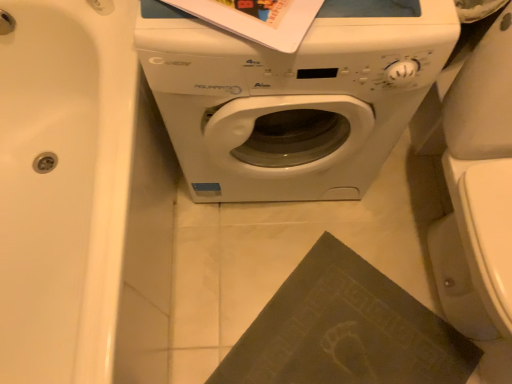
The image size is (512, 384). Describe the element at coordinates (293, 97) in the screenshot. I see `white glossy washing machine at center` at that location.

What do you see at coordinates (64, 187) in the screenshot? I see `white glossy bathtub at left` at bounding box center [64, 187].

You are a GUI agent. You are given a task and a screenshot of the screen. Output one action in this format:
    pyautogui.click(x=<x>, y=<y>)
    Task: Click on the dark matte book at lower right
    Image resolution: width=512 pixels, height=384 pixels.
    Given the screenshot: What is the action you would take?
    pyautogui.click(x=346, y=330)

Consider the image. Is white glossy washing machine at center wider or thinner than dark matte book at lower right?

Considering their sizes, white glossy washing machine at center looks broader than dark matte book at lower right.

Which of these two, white glossy washing machine at center or dark matte book at lower right, is bigger?

white glossy washing machine at center is bigger.

Is dark matte book at lower right a part of white glossy washing machine at center?

Definitely not — dark matte book at lower right is not inside white glossy washing machine at center.

At what (x,y) coordinates should I click in order to perform the action: click on washing machine lying above the dark matte book at lower right (from the image's perspective). Please return your answer as a coordinate pair (x, y). Looking at the image, I should click on (293, 97).

Which of these two, white glossy washing machine at center or white glossy bathtub at left, is bigger?

Bigger between the two is white glossy bathtub at left.

Is white glossy washing machine at center taller than white glossy bathtub at left?

Indeed, white glossy washing machine at center has a greater height compared to white glossy bathtub at left.

Does white glossy washing machine at center have a greater width compared to white glossy bathtub at left?

In fact, white glossy washing machine at center might be narrower than white glossy bathtub at left.

From the image's perspective, does white glossy washing machine at center appear lower than white glossy bathtub at left?

Incorrect, from the image's perspective, white glossy washing machine at center is higher than white glossy bathtub at left.

Can you confirm if white glossy bathtub at left is positioned to the right of white glossy washing machine at center?

In fact, white glossy bathtub at left is to the left of white glossy washing machine at center.

From a real-world perspective, who is located lower, white glossy bathtub at left or white glossy washing machine at center?

From a 3D spatial view, white glossy bathtub at left is below.

Considering the positions of point (68, 165) and point (289, 134), is point (68, 165) closer or farther from the camera than point (289, 134)?

Point (68, 165).

Is white glossy bathtub at left wider or thinner than white glossy washing machine at center?

In the image, white glossy bathtub at left appears to be wider than white glossy washing machine at center.

Is dark matte book at lower right to the left of white glossy bathtub at left from the viewer's perspective?

No, dark matte book at lower right is not to the left of white glossy bathtub at left.

From a real-world perspective, is dark matte book at lower right on white glossy bathtub at left?

No, from a real-world perspective, dark matte book at lower right is not above white glossy bathtub at left.

Is dark matte book at lower right looking in the opposite direction of white glossy bathtub at left?

No.

Looking at the image, does dark matte book at lower right seem bigger or smaller compared to white glossy bathtub at left?

Considering their sizes, dark matte book at lower right takes up less space than white glossy bathtub at left.

Is dark matte book at lower right looking in the opposite direction of white glossy washing machine at center?

No, dark matte book at lower right is not facing away from white glossy washing machine at center.

Is point (302, 362) positioned before point (281, 193)?

Yes, it is.

Is dark matte book at lower right bigger than white glossy washing machine at center?

No.

Is dark matte book at lower right inside or outside of white glossy washing machine at center?

dark matte book at lower right is not enclosed by white glossy washing machine at center.

Is white glossy bathtub at left with dark matte book at lower right?

white glossy bathtub at left and dark matte book at lower right are clearly separated.

Is white glossy bathtub at left completely or partially outside of dark matte book at lower right?

Indeed, white glossy bathtub at left is completely outside dark matte book at lower right.

From the image's perspective, is white glossy bathtub at left located above or below dark matte book at lower right?

From the image's perspective, white glossy bathtub at left appears above dark matte book at lower right.

From their relative heights in the image, would you say white glossy bathtub at left is taller or shorter than dark matte book at lower right?

white glossy bathtub at left is taller than dark matte book at lower right.

Where is `washing machine above the dark matte book at lower right (from the image's perspective)`? washing machine above the dark matte book at lower right (from the image's perspective) is located at coordinates (293, 97).

Locate an element on the screen. washing machine behind the white glossy bathtub at left is located at coordinates (293, 97).

Considering their positions, is white glossy bathtub at left positioned closer to white glossy washing machine at center than dark matte book at lower right?

Based on the image, white glossy bathtub at left appears to be nearer to white glossy washing machine at center.

Which object lies further to the anchor point white glossy bathtub at left, white glossy washing machine at center or dark matte book at lower right?

dark matte book at lower right.

From the image, which object appears to be farther from dark matte book at lower right, white glossy washing machine at center or white glossy bathtub at left?

Among the two, white glossy bathtub at left is located further to dark matte book at lower right.

Looking at the image, which one is located further to white glossy bathtub at left, dark matte book at lower right or white glossy washing machine at center?

Among the two, dark matte book at lower right is located further to white glossy bathtub at left.

Looking at the image, which one is located further to white glossy washing machine at center, dark matte book at lower right or white glossy bathtub at left?

The object further to white glossy washing machine at center is dark matte book at lower right.

Looking at this image, estimate the real-world distances between objects in this image. Which object is further from dark matte book at lower right, white glossy bathtub at left or white glossy washing machine at center?

The object further to dark matte book at lower right is white glossy bathtub at left.

The width and height of the screenshot is (512, 384). I want to click on washing machine located between white glossy bathtub at left and dark matte book at lower right in the left-right direction, so click(293, 97).